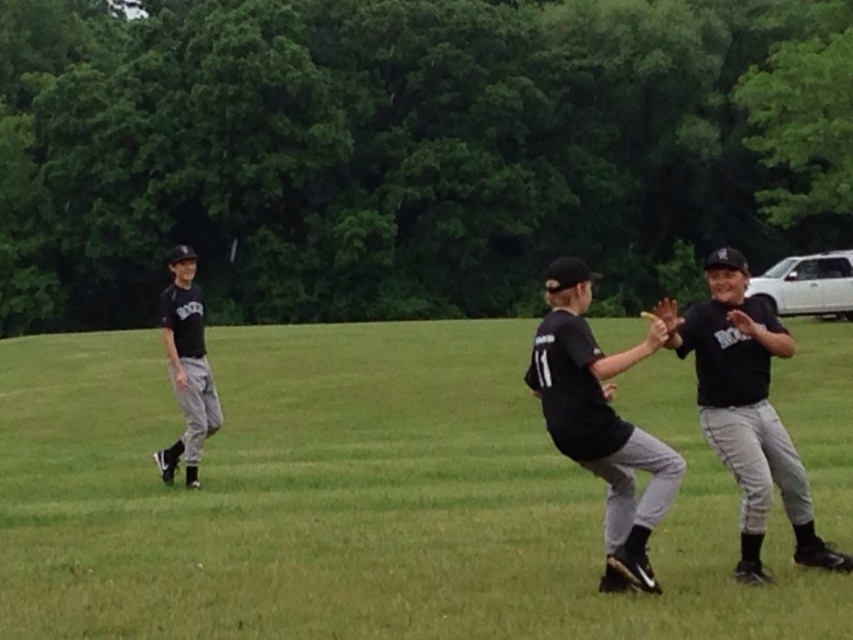
You are a drone operator trying to capture aerial footage of the baseball game. The camera is currently positioned at point A, which is at coordinates (357,497). What is the most prominent feature visible at that location?

The point at coordinates (357,497) marks green grass at center, so the most prominent feature visible there is green grass at center.

Looking at this image, you are a new player on the field and need to locate your equipment. There is a black matte baseball glove at center and a black matte uniform at left. According to the scene, which object is positioned to the right side?

The black matte baseball glove at center is positioned to the right of the black matte uniform at left.

You are a photographer trying to capture a closeup of the black matte baseball cap at upper right and the black matte baseball glove at center. Which object should you focus on first to ensure it appears sharp in your photo?

The black matte baseball cap at upper right is closer to the viewer than the black matte baseball glove at center, so you should focus on the black matte baseball cap at upper right first to ensure it appears sharp.